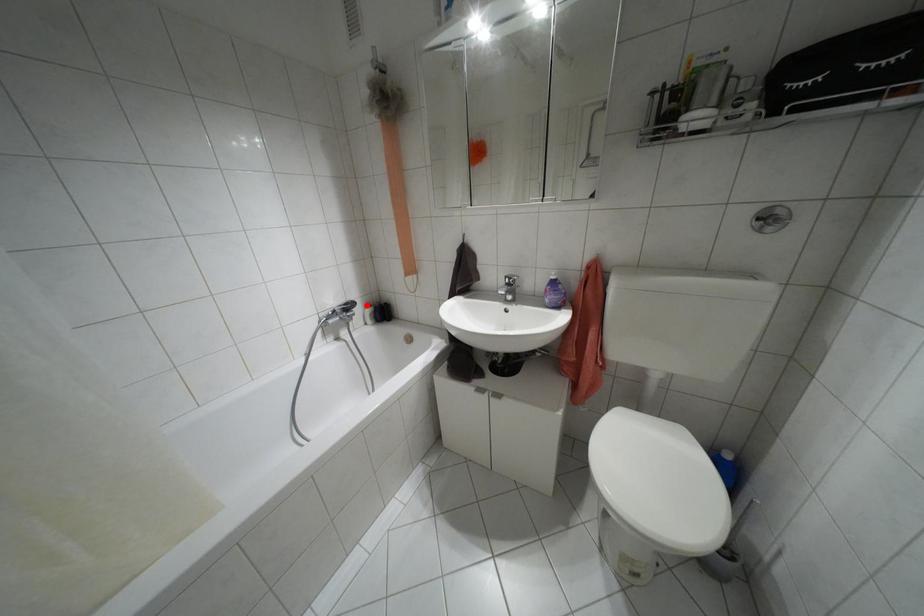
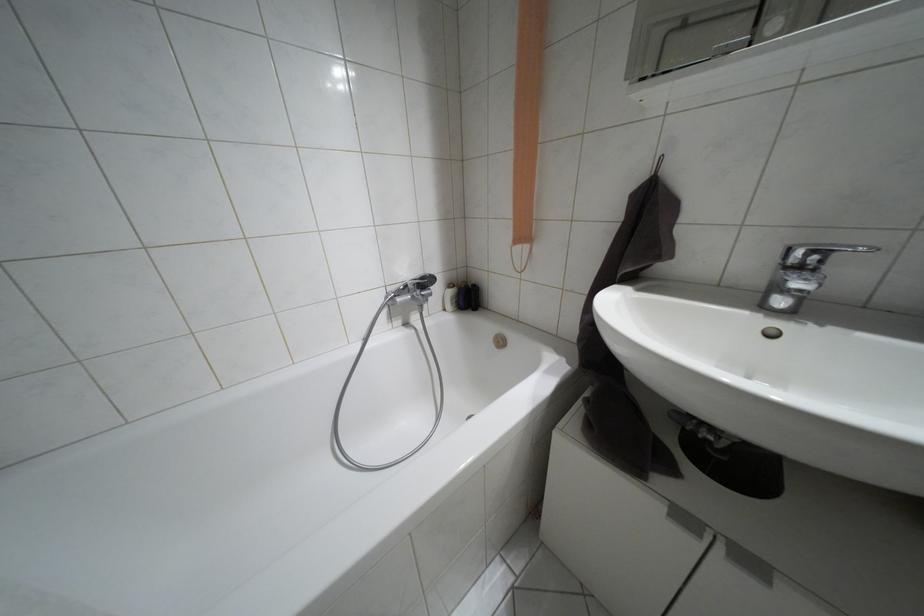
In the second image, find the point that corresponds to the highlighted location in the first image.

(448, 285)